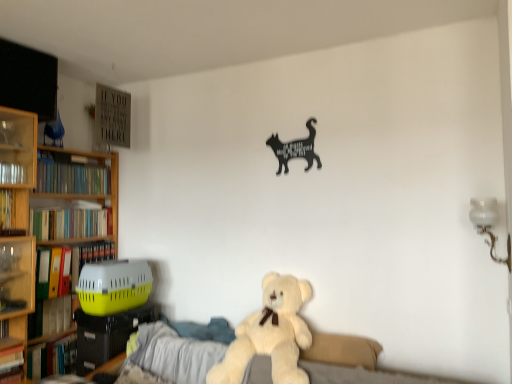
The width and height of the screenshot is (512, 384). What are the coordinates of `vacant region above hardcover book at left, positioned as the 1th book in bottom-to-top order (from a real-world perspective)` in the screenshot? It's located at (53, 336).